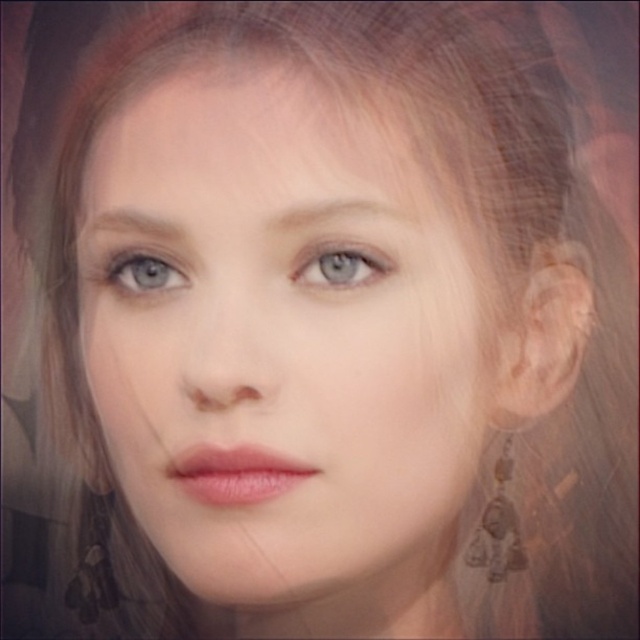
Is point (497, 500) positioned after point (176, 269)?

That is True.

Is gold textured earring at lower right bigger than blue glossy eye at upper left?

Yes, gold textured earring at lower right is bigger than blue glossy eye at upper left.

Who is more distant from viewer, (x=509, y=513) or (x=176, y=269)?

The point (x=509, y=513) is behind.

Identify the location of gold textured earring at lower right. (499, 525).

Between blue matte eye at center and blue glossy eye at upper left, which one appears on the left side from the viewer's perspective?

blue glossy eye at upper left

Is the position of blue matte eye at center more distant than that of blue glossy eye at upper left?

No, blue matte eye at center is closer to the viewer.

Find the location of `blue matte eye at center`. blue matte eye at center is located at coordinates (340, 264).

Is smooth skin face at center taller than gold textured earring at lower right?

Indeed, smooth skin face at center has a greater height compared to gold textured earring at lower right.

Which of these two, smooth skin face at center or gold textured earring at lower right, stands taller?

Standing taller between the two is smooth skin face at center.

Image resolution: width=640 pixels, height=640 pixels. What do you see at coordinates (278, 333) in the screenshot?
I see `smooth skin face at center` at bounding box center [278, 333].

Identify the location of smooth skin face at center. (278, 333).